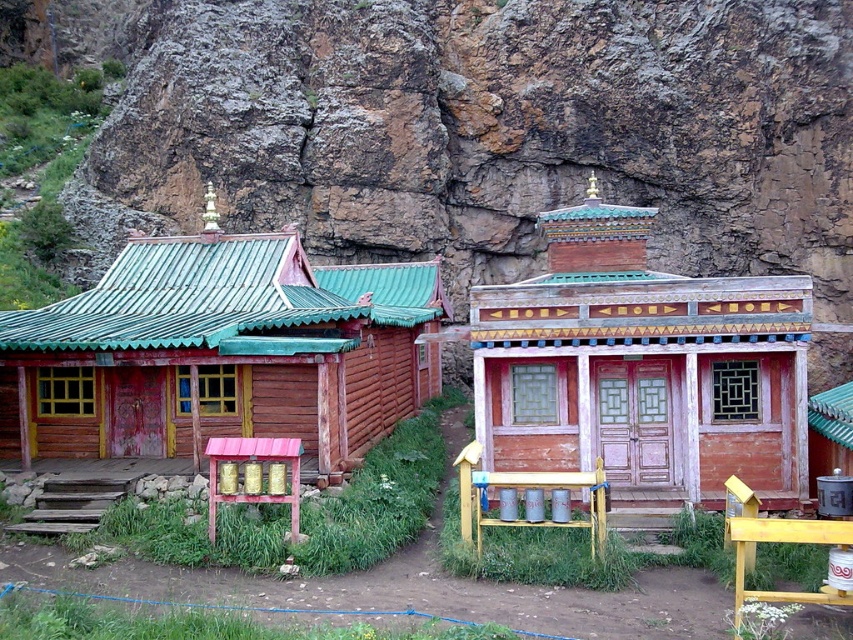
Question: Can you confirm if wooden cabin at left is thinner than wooden cabin at center?

Choices:
 (A) yes
 (B) no

Answer: (B)

Question: Among these points, which one is farthest from the camera?

Choices:
 (A) (491, 435)
 (B) (102, 376)

Answer: (B)

Question: Is wooden cabin at left smaller than wooden cabin at center?

Choices:
 (A) no
 (B) yes

Answer: (B)

Question: Can you confirm if wooden cabin at left is thinner than wooden cabin at center?

Choices:
 (A) no
 (B) yes

Answer: (A)

Question: Which point is closer to the camera?

Choices:
 (A) (589, 232)
 (B) (202, 380)

Answer: (B)